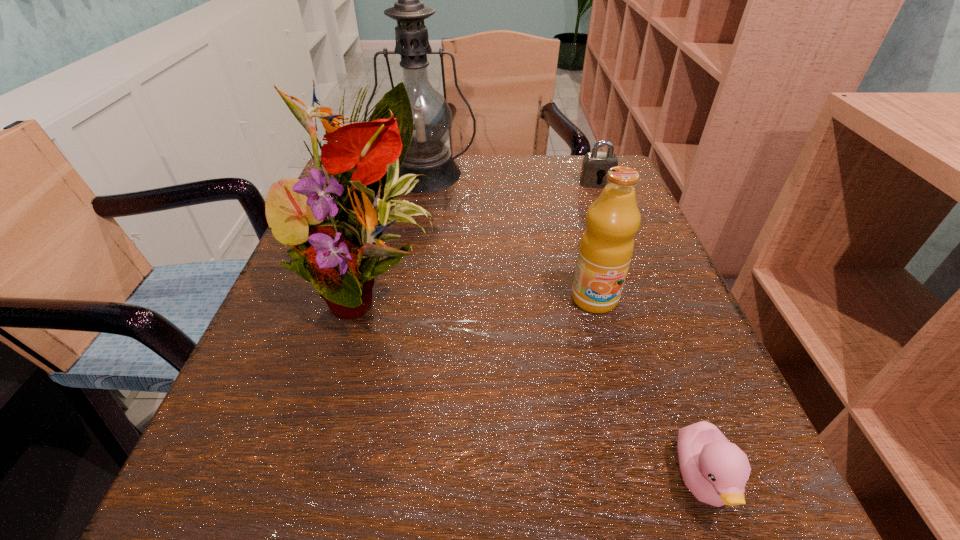
Where is `oil lamp`? oil lamp is located at coordinates (428, 154).

Where is `bouquet`? The image size is (960, 540). bouquet is located at coordinates (333, 254).

Where is `fruit juice`? This screenshot has width=960, height=540. fruit juice is located at coordinates (607, 244).

I want to click on padlock, so click(x=595, y=165).

This screenshot has width=960, height=540. I want to click on the shortest object, so click(715, 470).

Where is `duckling`? The width and height of the screenshot is (960, 540). duckling is located at coordinates (715, 470).

The width and height of the screenshot is (960, 540). Identify the location of vacant area situated 0.210m on the front of the oil lamp. (409, 253).

The height and width of the screenshot is (540, 960). Find the location of `vacant region located 0.140m on the front-facing side of the bouquet`. vacant region located 0.140m on the front-facing side of the bouquet is located at coordinates click(329, 447).

At what (x,y) coordinates should I click in order to perform the action: click on vacant space situated on the front label of the fruit juice. Please return your answer as a coordinate pair (x, y). The height and width of the screenshot is (540, 960). Looking at the image, I should click on (609, 350).

Identify the location of vacant space located at the front of the padlock near the keyhole. The height and width of the screenshot is (540, 960). (646, 313).